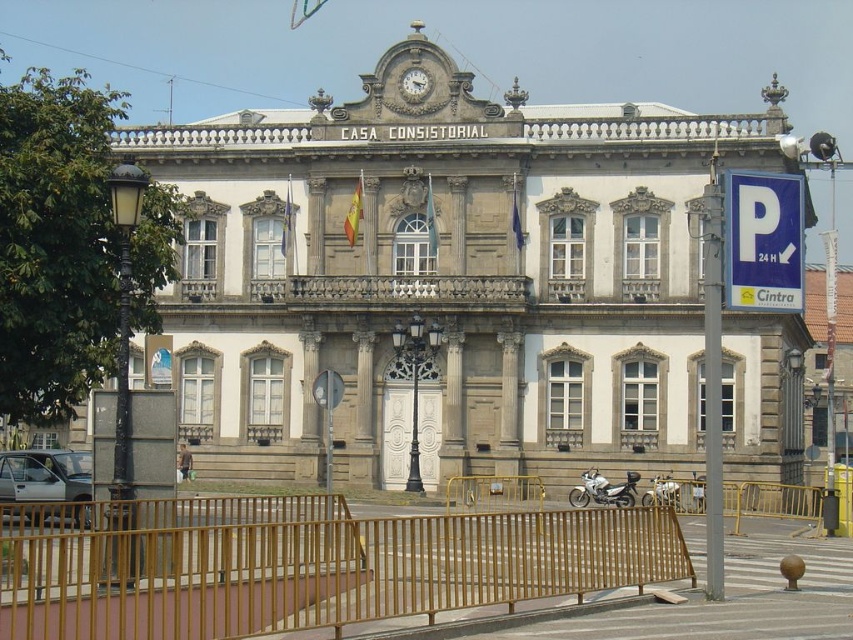
Question: Can you confirm if blue plastic parking sign at upper right is positioned below white metallic motorcycle at center?

Choices:
 (A) yes
 (B) no

Answer: (B)

Question: Is stone building at center closer to camera compared to gold textured clock at upper center?

Choices:
 (A) no
 (B) yes

Answer: (B)

Question: Can you confirm if stone building at center is thinner than brown wooden fence at lower center?

Choices:
 (A) no
 (B) yes

Answer: (A)

Question: Which of these objects is positioned closest to the white metallic motorcycle at center?

Choices:
 (A) gold textured clock at upper center
 (B) brown wooden fence at lower center
 (C) blue plastic parking sign at upper right
 (D) stone building at center

Answer: (D)

Question: Which of the following is the closest to the observer?

Choices:
 (A) gold textured clock at upper center
 (B) silver metallic motorcycle at center
 (C) blue plastic parking sign at upper right

Answer: (C)

Question: Considering the real-world distances, which object is closest to the gold textured clock at upper center?

Choices:
 (A) white metallic motorcycle at center
 (B) stone building at center
 (C) blue plastic parking sign at upper right

Answer: (B)